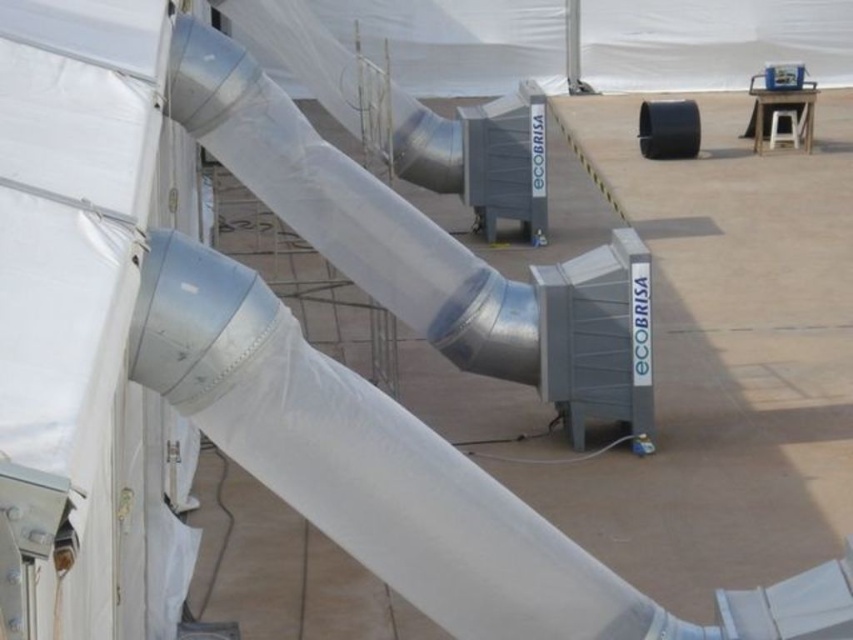
Question: Does silver metallic pole at upper center have a smaller size compared to white plastic stool at upper right?

Choices:
 (A) no
 (B) yes

Answer: (A)

Question: Can you confirm if silver metallic pole at upper center is wider than white plastic stool at upper right?

Choices:
 (A) no
 (B) yes

Answer: (A)

Question: Is silver metallic pole at upper center positioned at the back of white plastic stool at upper right?

Choices:
 (A) no
 (B) yes

Answer: (B)

Question: Which point is farther to the camera?

Choices:
 (A) (786, 113)
 (B) (572, 19)

Answer: (B)

Question: Which of the following is the farthest from the observer?

Choices:
 (A) white plastic stool at upper right
 (B) silver metallic pole at upper center

Answer: (B)